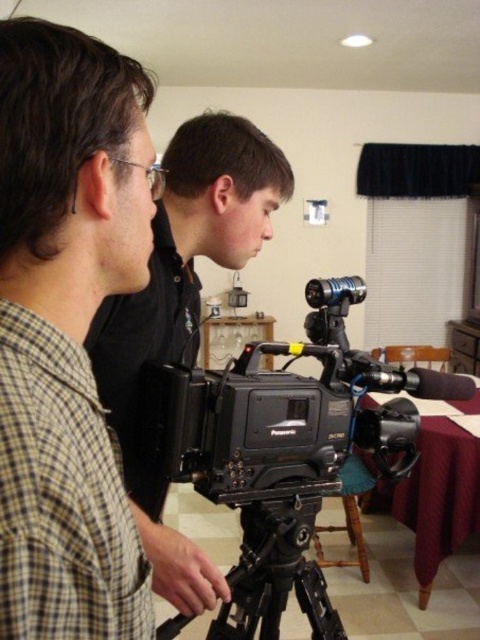
Which of these two, black plastic video camera at center or black matte camera at center, stands taller?

Standing taller between the two is black matte camera at center.

Between black plastic video camera at center and black matte camera at center, which one is positioned higher?

Positioned higher is black matte camera at center.

Does point (157, 403) come in front of point (204, 157)?

Yes, point (157, 403) is closer to viewer.

Locate an element on the screen. The image size is (480, 640). black plastic video camera at center is located at coordinates (283, 451).

Between point (405, 385) and point (312, 525), which one is positioned in front?

Point (312, 525)

Which is more to the right, black plastic video camera at center or black matte tripod at center?

black plastic video camera at center is more to the right.

Which is behind, point (255, 481) or point (264, 611)?

Positioned behind is point (264, 611).

This screenshot has width=480, height=640. Find the location of `black plastic video camera at center`. black plastic video camera at center is located at coordinates point(283,451).

Who is higher up, black matte camera at center or black matte tripod at center?

black matte camera at center is higher up.

Does black matte camera at center appear on the left side of black matte tripod at center?

Yes, black matte camera at center is to the left of black matte tripod at center.

Which is in front, point (241, 202) or point (250, 508)?

Point (241, 202) is more forward.

Where is `black matte camera at center`? black matte camera at center is located at coordinates (188, 252).